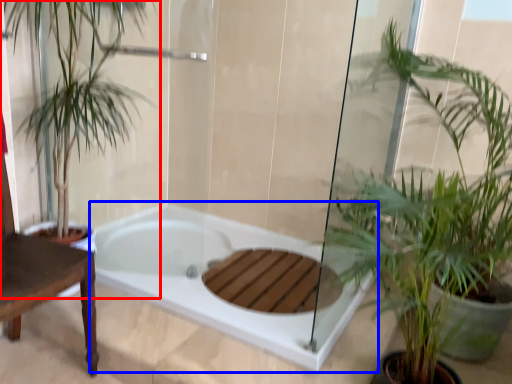
Question: Among these objects, which one is nearest to the camera, houseplant (highlighted by a red box) or bathtub (highlighted by a blue box)?

Choices:
 (A) houseplant
 (B) bathtub

Answer: (A)